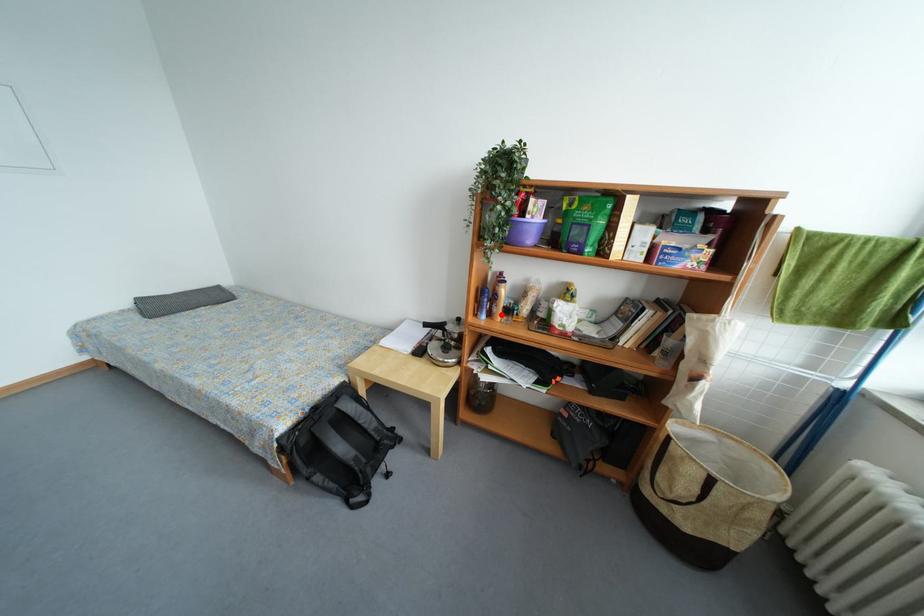
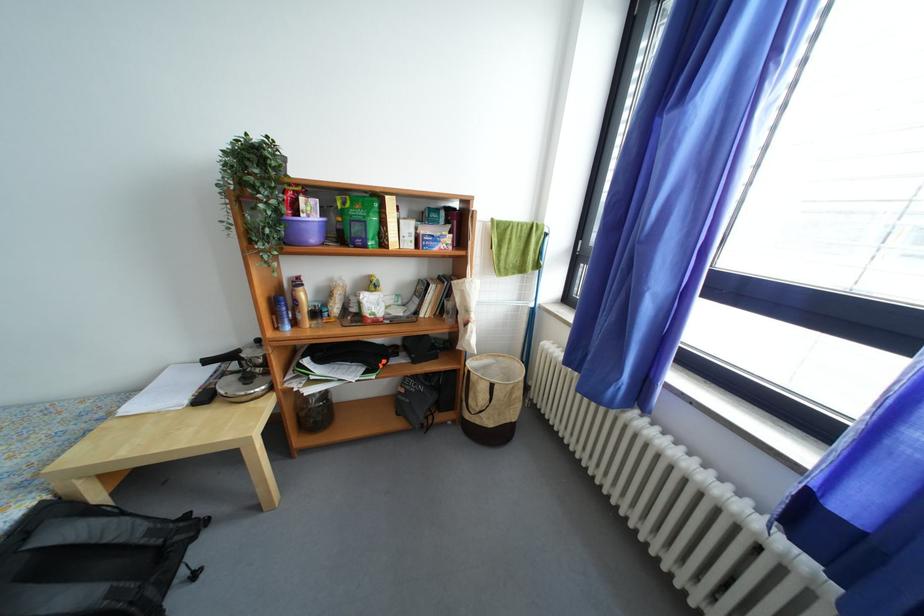
Find the pixel in the second image that matches the highlighted location in the first image.

(306, 322)